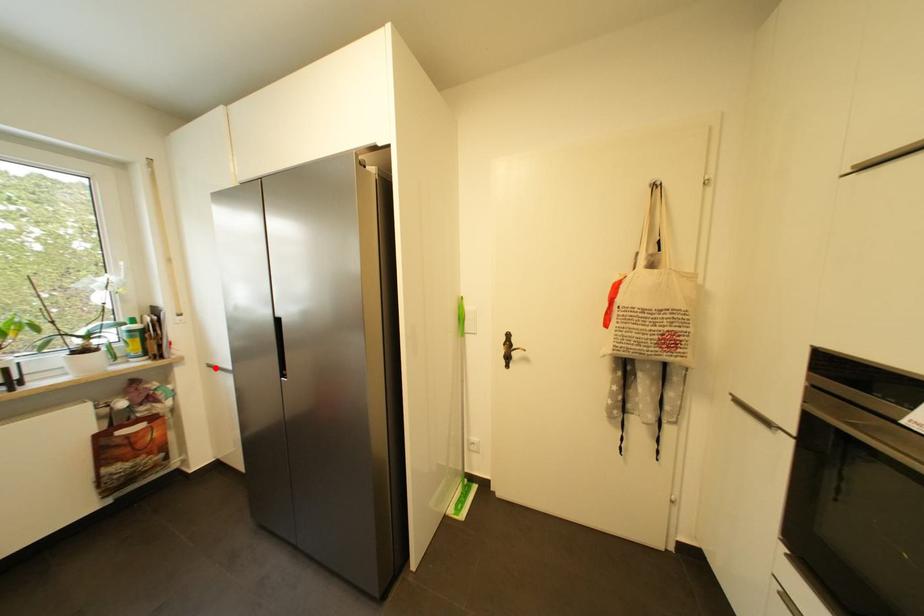
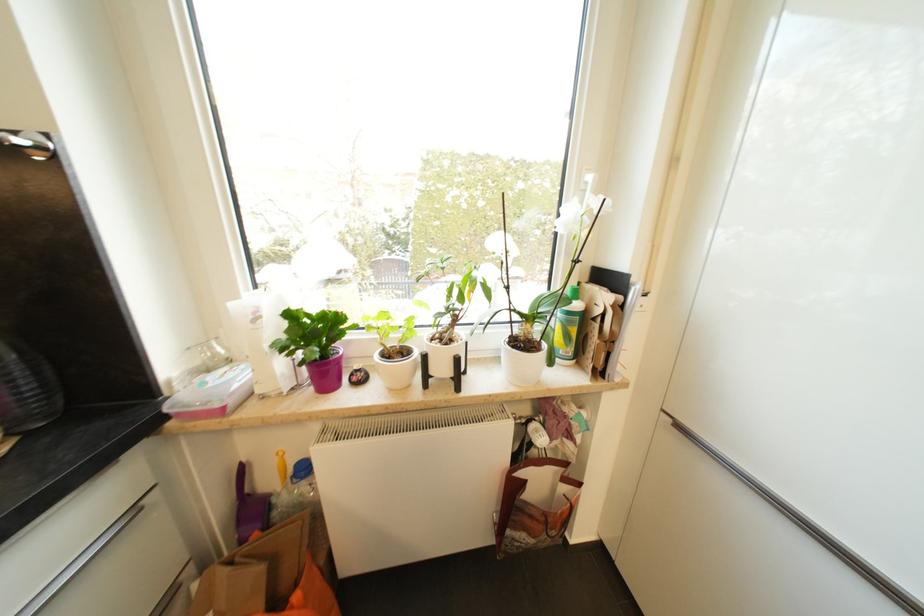
Where in the second image is the point corresponding to the highlighted location from the first image?

(685, 429)